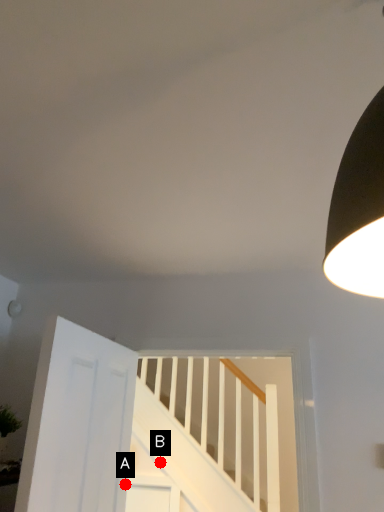
Question: Two points are circled on the image, labeled by A and B beside each circle. Which point is closer to the camera?

Choices:
 (A) A is closer
 (B) B is closer

Answer: (A)